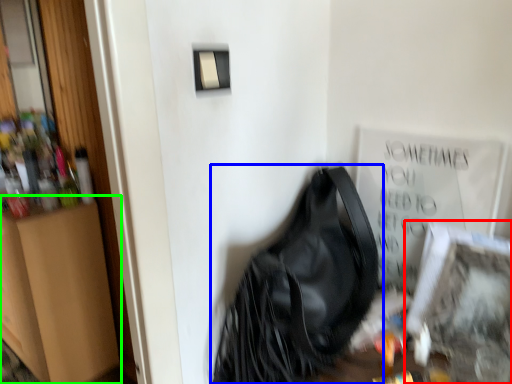
Question: Based on their relative distances, which object is nearer to picture frame (highlighted by a red box)? Choose from handbag (highlighted by a blue box) and dresser (highlighted by a green box).

Choices:
 (A) handbag
 (B) dresser

Answer: (A)